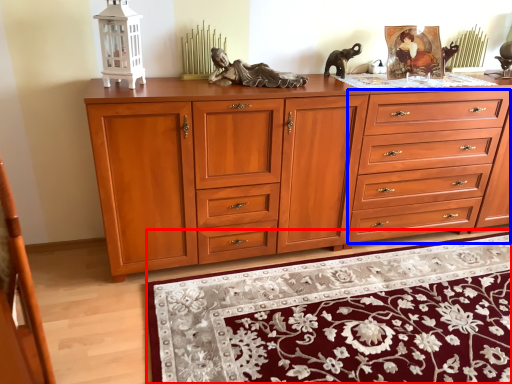
Question: Among these objects, which one is farthest to the camera, mat (highlighted by a red box) or drawer (highlighted by a blue box)?

Choices:
 (A) mat
 (B) drawer

Answer: (B)